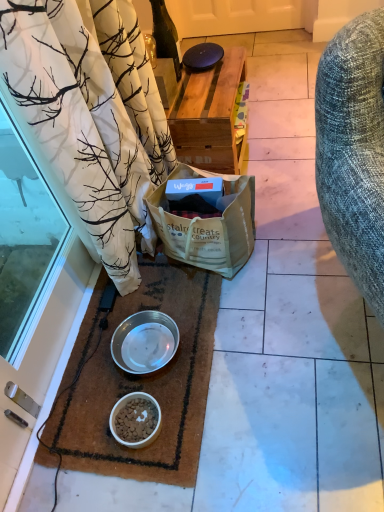
This screenshot has height=512, width=384. I want to click on empty space that is in between white matte bowl at lower center, which is the 2th bowl from top to bottom, and metallic silver bowl at lower center, arranged as the first bowl when viewed from the top, so pyautogui.click(x=129, y=394).